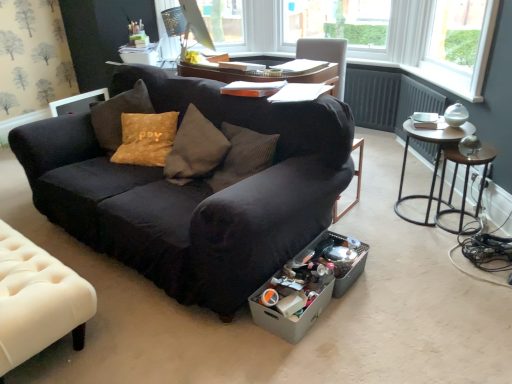
Where is `matte black monitor at upper center`? This screenshot has height=384, width=512. matte black monitor at upper center is located at coordinates (225, 25).

What is the approximate width of metallic brown side table at right?

metallic brown side table at right is 4.80 inches in width.

What do you see at coordinates (288, 318) in the screenshot? The height and width of the screenshot is (384, 512). I see `gray cardboard box at lower center` at bounding box center [288, 318].

Locate an element on the screen. The height and width of the screenshot is (384, 512). black fabric couch at center is located at coordinates (194, 191).

Considering the relative sizes of matte black monitor at upper center and black fabric couch at center in the image provided, is matte black monitor at upper center bigger than black fabric couch at center?

No, matte black monitor at upper center is not bigger than black fabric couch at center.

Which of these two, matte black monitor at upper center or black fabric couch at center, stands shorter?

matte black monitor at upper center is shorter.

Can we say matte black monitor at upper center lies outside black fabric couch at center?

Absolutely, matte black monitor at upper center is external to black fabric couch at center.

Are matte black monitor at upper center and black fabric couch at center beside each other?

No, matte black monitor at upper center is not next to black fabric couch at center.

From the image's perspective, between black fabric couch at center and white tufted leather at lower left, who is located below?

From the image's view, white tufted leather at lower left is below.

Does point (232, 191) come farther from viewer compared to point (38, 280)?

No, it is not.

Which object is more forward, black fabric couch at center or white tufted leather at lower left?

black fabric couch at center.

Which object is wider, black fabric couch at center or white tufted leather at lower left?

Wider between the two is black fabric couch at center.

Is gray cardboard box at lower center oriented away from matte black monitor at upper center?

No, gray cardboard box at lower center is not facing the opposite direction of matte black monitor at upper center.

Does gray cardboard box at lower center lie in front of matte black monitor at upper center?

Yes, it is in front of matte black monitor at upper center.

Considering the relative positions of gray cardboard box at lower center and matte black monitor at upper center in the image provided, is gray cardboard box at lower center to the left of matte black monitor at upper center from the viewer's perspective?

Incorrect, gray cardboard box at lower center is not on the left side of matte black monitor at upper center.

From a real-world perspective, is gray cardboard box at lower center above or below matte black monitor at upper center?

gray cardboard box at lower center is situated lower than matte black monitor at upper center in the real world.

Can you confirm if gray cardboard box at lower center is wider than black fabric couch at center?

Incorrect, the width of gray cardboard box at lower center does not surpass that of black fabric couch at center.

From a real-world perspective, is gray cardboard box at lower center physically located above or below black fabric couch at center?

gray cardboard box at lower center is below black fabric couch at center.

In the scene shown: Is the position of gray cardboard box at lower center less distant than that of black fabric couch at center?

No, gray cardboard box at lower center is further to the viewer.

Is there a large distance between gray cardboard box at lower center and black fabric couch at center?

That's not correct — gray cardboard box at lower center is a little close to black fabric couch at center.

Is the depth of metallic brown side table at right less than that of black fabric couch at center?

No.

Considering the relative sizes of metallic brown side table at right and black fabric couch at center in the image provided, is metallic brown side table at right thinner than black fabric couch at center?

Indeed, metallic brown side table at right has a lesser width compared to black fabric couch at center.

Are metallic brown side table at right and black fabric couch at center far apart?

Yes, metallic brown side table at right and black fabric couch at center are located far from each other.

From the image's perspective, is metallic brown side table at right located above or below black fabric couch at center?

From the image's perspective, metallic brown side table at right appears below black fabric couch at center.

Is white tufted leather at lower left wider or thinner than metallic round table at right?

Clearly, white tufted leather at lower left has more width compared to metallic round table at right.

From their relative heights in the image, would you say white tufted leather at lower left is taller or shorter than metallic round table at right?

Clearly, white tufted leather at lower left is shorter compared to metallic round table at right.

Based on their sizes in the image, would you say white tufted leather at lower left is bigger or smaller than metallic round table at right?

white tufted leather at lower left is bigger than metallic round table at right.

Considering the sizes of objects metallic brown side table at right and gray cardboard box at lower center in the image provided, who is wider, metallic brown side table at right or gray cardboard box at lower center?

gray cardboard box at lower center is wider.

Considering the positions of objects metallic brown side table at right and gray cardboard box at lower center in the image provided, who is more to the left, metallic brown side table at right or gray cardboard box at lower center?

gray cardboard box at lower center.

The image size is (512, 384). Identify the location of side table above the gray cardboard box at lower center (from a real-world perspective). (466, 182).

Looking at this image, what's the angular difference between metallic brown side table at right and gray cardboard box at lower center's facing directions?

metallic brown side table at right and gray cardboard box at lower center are facing 139 degrees away from each other.

The image size is (512, 384). What are the coordinates of `window screen above the black fabric couch at center (from a real-world perspective)` in the screenshot? It's located at (225, 25).

Locate an element on the screen. This screenshot has width=512, height=384. studio couch in front of the white tufted leather at lower left is located at coordinates (194, 191).

Looking at this image, which object lies further to the anchor point black fabric couch at center, white tufted leather at lower left or metallic brown side table at right?

metallic brown side table at right is further to black fabric couch at center.

Estimate the real-world distances between objects in this image. Which object is further from black fabric couch at center, matte black monitor at upper center or white tufted leather at lower left?

matte black monitor at upper center is further to black fabric couch at center.

In the scene shown: When comparing their distances from white tufted leather at lower left, does matte black monitor at upper center or black fabric couch at center seem further?

matte black monitor at upper center.

Which object lies further to the anchor point matte black monitor at upper center, metallic round table at right or white tufted leather at lower left?

Among the two, white tufted leather at lower left is located further to matte black monitor at upper center.

Looking at the image, which one is located further to gray cardboard box at lower center, metallic round table at right or matte black monitor at upper center?

matte black monitor at upper center is positioned further to the anchor gray cardboard box at lower center.

Estimate the real-world distances between objects in this image. Which object is further from matte black monitor at upper center, gray cardboard box at lower center or metallic round table at right?

gray cardboard box at lower center.

When comparing their distances from gray cardboard box at lower center, does white tufted leather at lower left or metallic brown side table at right seem closer?

The object closer to gray cardboard box at lower center is white tufted leather at lower left.

Considering their positions, is metallic brown side table at right positioned further to white tufted leather at lower left than gray cardboard box at lower center?

Among the two, metallic brown side table at right is located further to white tufted leather at lower left.

Identify the location of window screen between black fabric couch at center and metallic round table at right in the horizontal direction. The width and height of the screenshot is (512, 384). (225, 25).

The image size is (512, 384). In order to click on studio couch between white tufted leather at lower left and gray cardboard box at lower center in the horizontal direction in this screenshot , I will do `click(194, 191)`.

Where is `cardboard box situated between matte black monitor at upper center and metallic brown side table at right from left to right`? cardboard box situated between matte black monitor at upper center and metallic brown side table at right from left to right is located at coordinates (288, 318).

Identify the location of studio couch between white tufted leather at lower left and metallic round table at right. (194, 191).